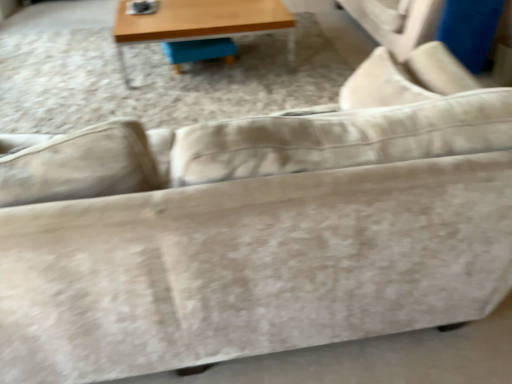
What do you see at coordinates (199, 51) in the screenshot?
I see `blue fabric swivel chair at center` at bounding box center [199, 51].

What is the approximate width of blue fabric swivel chair at center?

9.63 inches.

Measure the distance between blue fabric swivel chair at center and camera.

blue fabric swivel chair at center is 3.11 meters from camera.

Image resolution: width=512 pixels, height=384 pixels. What are the coordinates of `blue fabric swivel chair at center` in the screenshot? It's located at (199, 51).

At what (x,y) coordinates should I click in order to perform the action: click on wooden table at upper center. Please return your answer as a coordinate pair (x, y). Image resolution: width=512 pixels, height=384 pixels. Looking at the image, I should click on (202, 23).

Describe the element at coordinates (202, 23) in the screenshot. I see `wooden table at upper center` at that location.

The height and width of the screenshot is (384, 512). Find the location of `blue fabric swivel chair at center`. blue fabric swivel chair at center is located at coordinates (199, 51).

Can you confirm if wooden table at upper center is positioned to the right of blue fabric swivel chair at center?

Yes.

Is wooden table at upper center in front of blue fabric swivel chair at center?

Yes, it is.

Considering the positions of points (156, 33) and (218, 52), is point (156, 33) farther from camera compared to point (218, 52)?

That is False.

Consider the image. From the image's perspective, which is below, wooden table at upper center or blue fabric swivel chair at center?

blue fabric swivel chair at center, from the image's perspective.

From a real-world perspective, which is physically above, wooden table at upper center or blue fabric swivel chair at center?

wooden table at upper center.

Between wooden table at upper center and blue fabric swivel chair at center, which one has larger width?

wooden table at upper center is wider.

Looking at this image, between wooden table at upper center and blue fabric swivel chair at center, which one has less height?

blue fabric swivel chair at center is shorter.

Considering the sizes of objects wooden table at upper center and blue fabric swivel chair at center in the image provided, who is smaller, wooden table at upper center or blue fabric swivel chair at center?

With smaller size is blue fabric swivel chair at center.

Is wooden table at upper center inside or outside of blue fabric swivel chair at center?

wooden table at upper center is not enclosed by blue fabric swivel chair at center.

Does wooden table at upper center touch blue fabric swivel chair at center?

wooden table at upper center is not next to blue fabric swivel chair at center, and they're not touching.

Is wooden table at upper center aimed at blue fabric swivel chair at center?

Yes.

Measure the distance between wooden table at upper center and blue fabric swivel chair at center.

A distance of 11.50 inches exists between wooden table at upper center and blue fabric swivel chair at center.

You are a GUI agent. You are given a task and a screenshot of the screen. Output one action in this format:
    pyautogui.click(x=<x>, y=<y>)
    Task: Click on the swivel chair below the wooden table at upper center (from the image's perspective)
    The image size is (512, 384).
    Given the screenshot: What is the action you would take?
    pyautogui.click(x=199, y=51)

Which is more to the right, blue fabric swivel chair at center or wooden table at upper center?

Positioned to the right is wooden table at upper center.

Between blue fabric swivel chair at center and wooden table at upper center, which one is positioned in front?

wooden table at upper center is more forward.

Does point (170, 60) come in front of point (184, 2)?

No, (170, 60) is further to viewer.

From the image's perspective, is blue fabric swivel chair at center below wooden table at upper center?

Yes.

From a real-world perspective, is blue fabric swivel chair at center physically above wooden table at upper center?

No, from a real-world perspective, blue fabric swivel chair at center is not over wooden table at upper center

Does blue fabric swivel chair at center have a greater width compared to wooden table at upper center?

In fact, blue fabric swivel chair at center might be narrower than wooden table at upper center.

Considering the relative sizes of blue fabric swivel chair at center and wooden table at upper center in the image provided, is blue fabric swivel chair at center shorter than wooden table at upper center?

Yes, blue fabric swivel chair at center is shorter than wooden table at upper center.

From the picture: Who is smaller, blue fabric swivel chair at center or wooden table at upper center?

Smaller between the two is blue fabric swivel chair at center.

Is blue fabric swivel chair at center not within wooden table at upper center?

That's incorrect, blue fabric swivel chair at center is not completely outside wooden table at upper center.

Is blue fabric swivel chair at center placed right next to wooden table at upper center?

No, blue fabric swivel chair at center is not next to wooden table at upper center.

Is blue fabric swivel chair at center oriented away from wooden table at upper center?

Yes.

In the scene shown: How many degrees apart are the facing directions of blue fabric swivel chair at center and wooden table at upper center?

blue fabric swivel chair at center and wooden table at upper center are facing 8.04 degrees away from each other.

You are a GUI agent. You are given a task and a screenshot of the screen. Output one action in this format:
    pyautogui.click(x=<x>, y=<y>)
    Task: Click on the swivel chair below the wooden table at upper center (from the image's perspective)
    Image resolution: width=512 pixels, height=384 pixels.
    Given the screenshot: What is the action you would take?
    pyautogui.click(x=199, y=51)

Identify the location of table in front of the blue fabric swivel chair at center. This screenshot has width=512, height=384. (202, 23).

Where is `swivel chair below the wooden table at upper center (from a real-world perspective)`? swivel chair below the wooden table at upper center (from a real-world perspective) is located at coordinates (199, 51).